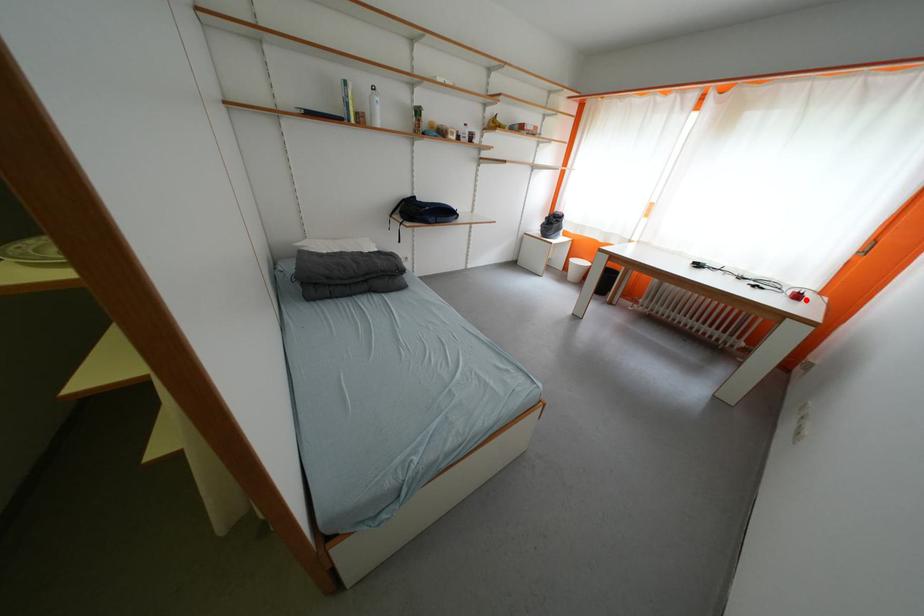
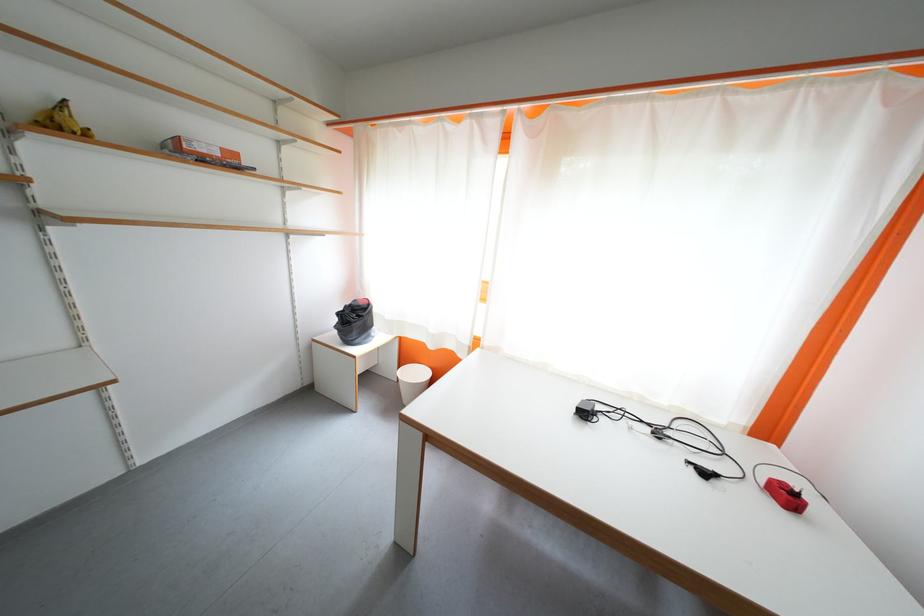
The point at the highlighted location is marked in the first image. Where is the corresponding point in the second image?

(796, 500)